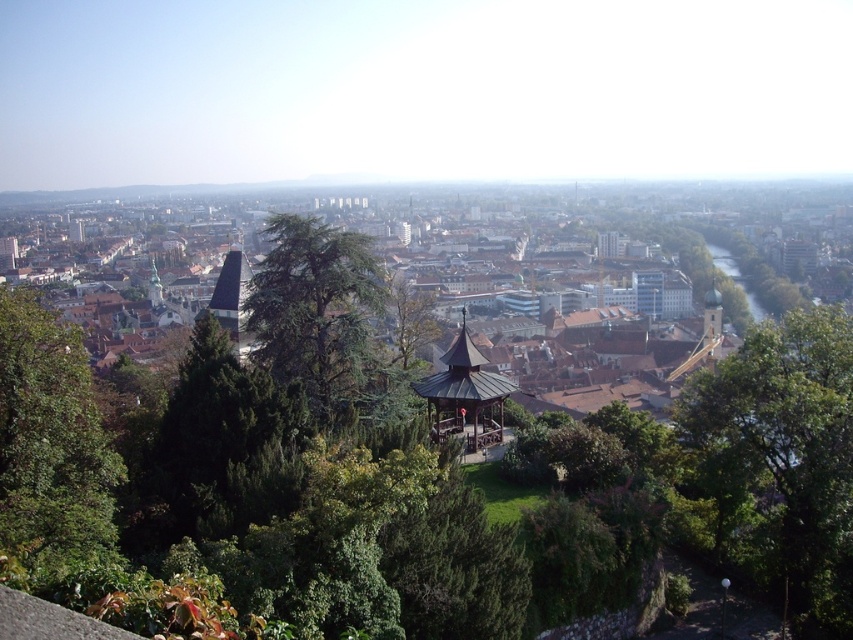
Question: Observing the image, what is the correct spatial positioning of green leafy tree at right in reference to green textured tree at center?

Choices:
 (A) left
 (B) right

Answer: (B)

Question: Which of these objects is positioned farthest from the green textured tree at center?

Choices:
 (A) brown wooden gazebo at center
 (B) green leafy tree at left
 (C) green leafy tree at right

Answer: (A)

Question: Which of these objects is positioned farthest from the brown wooden gazebo at center?

Choices:
 (A) wooden gazebo at center
 (B) green leafy tree at left
 (C) green textured tree at center

Answer: (C)

Question: Which point appears farthest from the camera in this image?

Choices:
 (A) (846, 499)
 (B) (467, 401)

Answer: (B)

Question: Does green leafy tree at left come behind wooden gazebo at center?

Choices:
 (A) no
 (B) yes

Answer: (A)

Question: Is brown wooden gazebo at center positioned behind wooden gazebo at center?

Choices:
 (A) no
 (B) yes

Answer: (B)